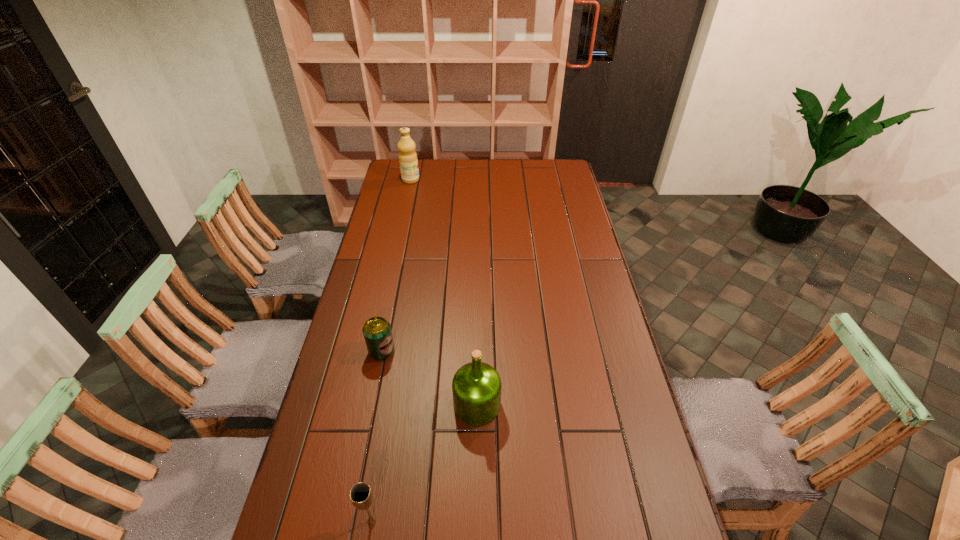
Identify the location of vacant region that satisfies the following two spatial constraints: 1. on the label of the left olive oil; 2. on the back side of the third farthest object. pos(361,405).

Find the location of a particular element. vacant position in the image that satisfies the following two spatial constraints: 1. on the label of the farthest object; 2. on the back side of the third nearest object is located at coordinates (372, 351).

Image resolution: width=960 pixels, height=540 pixels. I want to click on free space in the image that satisfies the following two spatial constraints: 1. on the label of the left olive oil; 2. on the left side of the chalice, so click(x=335, y=521).

Find the location of a particular element. Image resolution: width=960 pixels, height=540 pixels. free point that satisfies the following two spatial constraints: 1. on the label of the third nearest object; 2. on the left side of the farther olive oil is located at coordinates [372, 351].

You are a GUI agent. You are given a task and a screenshot of the screen. Output one action in this format:
    pyautogui.click(x=<x>, y=<y>)
    Task: Click on the free spot that satisfies the following two spatial constraints: 1. on the label of the left olive oil; 2. on the back side of the nearer olive oil
    The width and height of the screenshot is (960, 540).
    Given the screenshot: What is the action you would take?
    pyautogui.click(x=361, y=405)

Locate an element on the screen. blank space that satisfies the following two spatial constraints: 1. on the label of the beer can; 2. on the left side of the farther olive oil is located at coordinates (372, 351).

What are the coordinates of `vacant space that satisfies the following two spatial constraints: 1. on the label of the left olive oil; 2. on the right side of the nearer olive oil` in the screenshot? It's located at (361, 405).